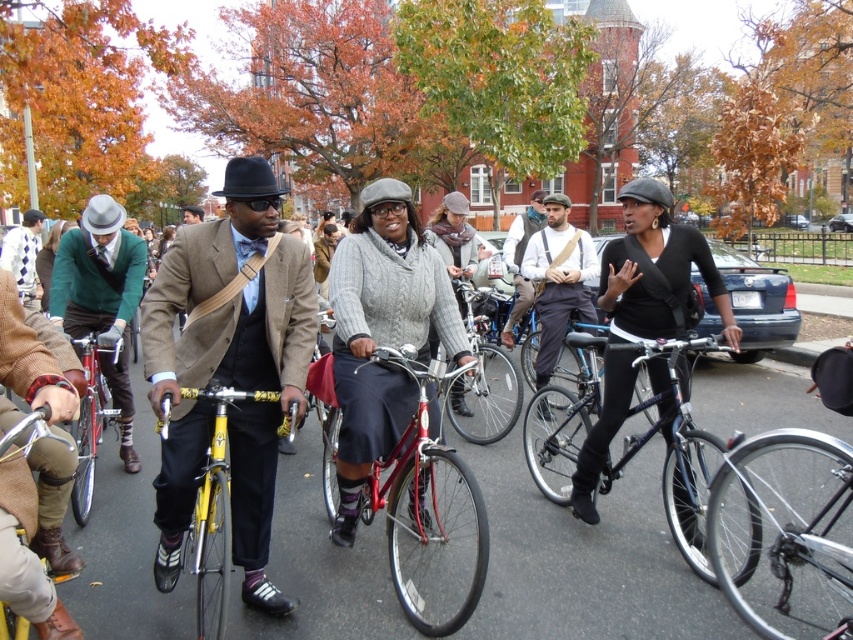
Question: Is knitted sweater at center positioned in front of matte gray bicycle helmet at upper right?

Choices:
 (A) yes
 (B) no

Answer: (A)

Question: Which object is closer to the camera taking this photo?

Choices:
 (A) knitted sweater at center
 (B) matte gray bicycle helmet at upper right
 (C) shiny red bicycle at center

Answer: (C)

Question: Where is matte brown leather jacket at center located in relation to yellow matte bicycle at lower left in the image?

Choices:
 (A) left
 (B) right

Answer: (B)

Question: Is matte white shirt at center closer to the viewer compared to matte gray bicycle helmet at upper right?

Choices:
 (A) yes
 (B) no

Answer: (B)

Question: Which object appears farthest from the camera in this image?

Choices:
 (A) matte green sweater at left
 (B) black matte sweater at center

Answer: (A)

Question: Which point is closer to the camera taking this photo?

Choices:
 (A) tap(84, 493)
 (B) tap(137, 237)
 (C) tap(297, 292)

Answer: (C)